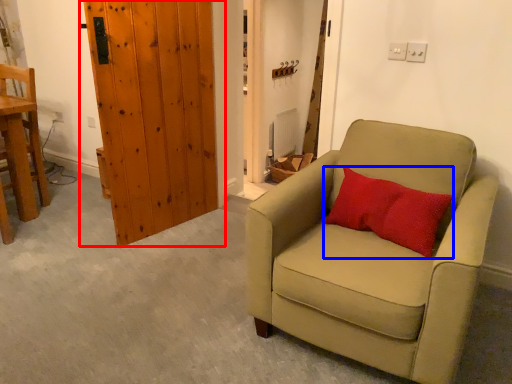
Question: Which object appears closest to the camera in this image, door (highlighted by a red box) or pillow (highlighted by a blue box)?

Choices:
 (A) door
 (B) pillow

Answer: (B)